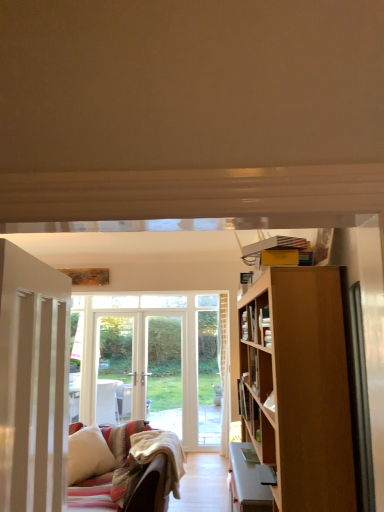
This screenshot has width=384, height=512. I want to click on white wooden door at left, so click(x=33, y=382).

The width and height of the screenshot is (384, 512). I want to click on white soft pillow at lower left, so click(x=88, y=454).

You are a GUI agent. You are given a task and a screenshot of the screen. Output one action in this format:
    pyautogui.click(x=<x>, y=<y>)
    Task: Click on the door in front of the hardcover book at center
    The image size is (384, 512).
    Given the screenshot: What is the action you would take?
    pyautogui.click(x=33, y=382)

Which object is further away from the camera, white wooden door at left or hardcover book at center?

Positioned behind is hardcover book at center.

From a real-world perspective, which is physically below, white wooden door at left or hardcover book at center?

From a 3D spatial view, hardcover book at center is below.

Considering the sizes of objects white wooden door at left and hardcover book at center in the image provided, who is smaller, white wooden door at left or hardcover book at center?

With smaller size is hardcover book at center.

How many degrees apart are the facing directions of hardcover book at center and white wooden door at left?

There is a 172-degree angle between the facing directions of hardcover book at center and white wooden door at left.

How much distance is there between hardcover book at center and white wooden door at left?

hardcover book at center and white wooden door at left are 1.83 meters apart.

Is hardcover book at center taller than white wooden door at left?

No, hardcover book at center is not taller than white wooden door at left.

Is white wooden door at left at the back of hardcover book at center?

No, white wooden door at left is not at the back of hardcover book at center.

Looking at this image, is white wooden door at left taller or shorter than white soft pillow at lower left?

Considering their sizes, white wooden door at left has more height than white soft pillow at lower left.

Is white wooden door at left further to camera compared to white soft pillow at lower left?

That is False.

Can we say white wooden door at left lies outside white soft pillow at lower left?

white wooden door at left is positioned outside white soft pillow at lower left.

Which is farther from the camera, (238, 403) or (70, 465)?

Positioned behind is point (70, 465).

Based on the photo, looking at their sizes, would you say hardcover book at center is wider or thinner than white soft pillow at lower left?

hardcover book at center is thinner than white soft pillow at lower left.

Consider the image. Is hardcover book at center positioned with its back to white soft pillow at lower left?

No, white soft pillow at lower left is not at the back of hardcover book at center.

From the image's perspective, is hardcover book at center beneath white soft pillow at lower left?

Actually, hardcover book at center appears above white soft pillow at lower left in the image.

Could hardcover book at center be considered to be inside white soft pillow at lower left?

No, hardcover book at center is not a part of white soft pillow at lower left.

In the scene shown: From a real-world perspective, relative to hardcover book at center, is white soft pillow at lower left vertically above or below?

Clearly, from a real-world perspective, white soft pillow at lower left is below hardcover book at center.

Is the position of white soft pillow at lower left more distant than that of hardcover book at center?

Yes, white soft pillow at lower left is behind hardcover book at center.

Based on the photo, are white soft pillow at lower left and hardcover book at center far apart?

Yes, white soft pillow at lower left and hardcover book at center are located far from each other.

Is point (92, 455) farther from viewer compared to point (53, 444)?

Yes, point (92, 455) is behind point (53, 444).

Is white soft pillow at lower left in front of white wooden door at left?

No, white soft pillow at lower left is further to the viewer.

Who is shorter, white soft pillow at lower left or white wooden door at left?

With less height is white soft pillow at lower left.

Looking at this image, is white soft pillow at lower left wider than white wooden door at left?

Yes.

Where is `book behind the white wooden door at left`? book behind the white wooden door at left is located at coordinates (243, 399).

This screenshot has height=512, width=384. What are the coordinates of `book that appears on the right of white wooden door at left` in the screenshot? It's located at [x=243, y=399].

Considering their positions, is white wooden door at left positioned closer to hardcover book at center than white soft pillow at lower left?

Based on the image, white wooden door at left appears to be nearer to hardcover book at center.

Looking at the image, which one is located further to white soft pillow at lower left, hardcover book at center or white wooden door at left?

white wooden door at left.

When comparing their distances from hardcover book at center, does white soft pillow at lower left or white wooden door at left seem closer?

white wooden door at left is positioned closer to the anchor hardcover book at center.

From the image, which object appears to be farther from white soft pillow at lower left, white wooden door at left or hardcover book at center?

white wooden door at left is positioned further to the anchor white soft pillow at lower left.

From the image, which object appears to be nearer to white wooden door at left, hardcover book at center or white soft pillow at lower left?

Among the two, hardcover book at center is located nearer to white wooden door at left.

Looking at this image, looking at the image, which one is located further to white wooden door at left, white soft pillow at lower left or hardcover book at center?

white soft pillow at lower left.

Identify the location of book between white wooden door at left and white soft pillow at lower left in the front-back direction. The height and width of the screenshot is (512, 384). (243, 399).